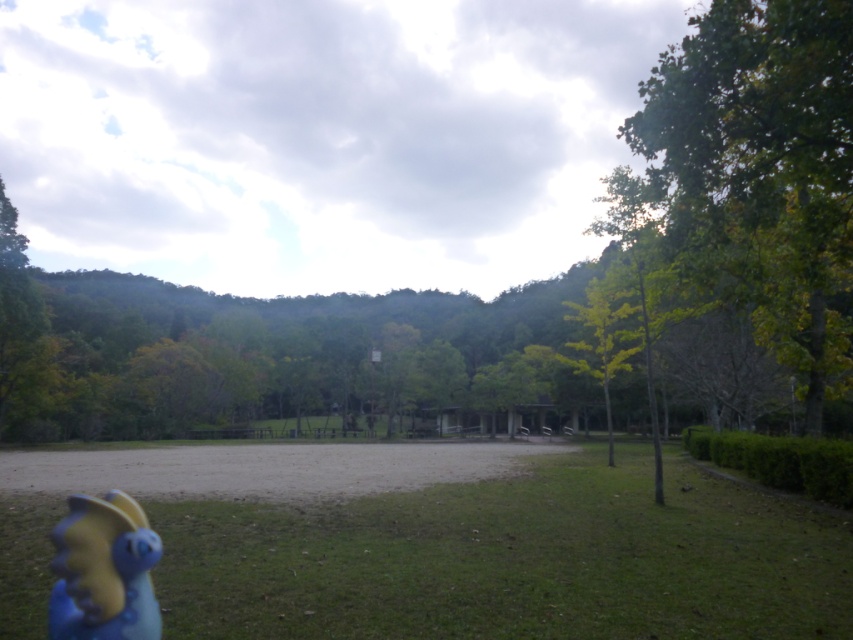
You are standing at the point with coordinates point [714,186] and want to walk towards the point with coordinates point [325,573]. Which direction should you move?

You should move forward because point [325,573] is in front of point [714,186].